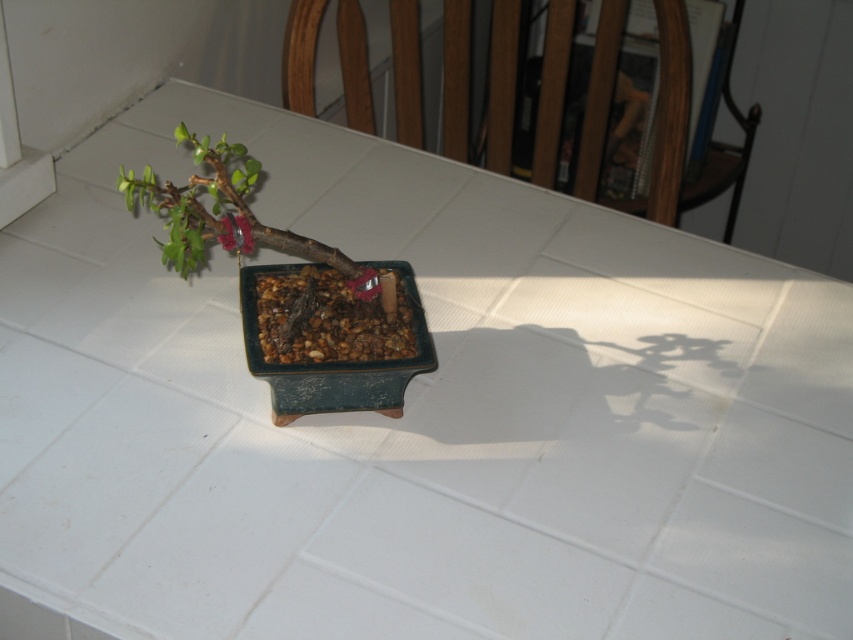
Question: Is green matte bonsai at center positioned before matte green flower at upper left?

Choices:
 (A) no
 (B) yes

Answer: (B)

Question: Can you confirm if green matte bonsai at center is positioned to the right of matte green flower at upper left?

Choices:
 (A) no
 (B) yes

Answer: (A)

Question: Is green matte bonsai at center closer to the viewer compared to matte green flower at upper left?

Choices:
 (A) yes
 (B) no

Answer: (A)